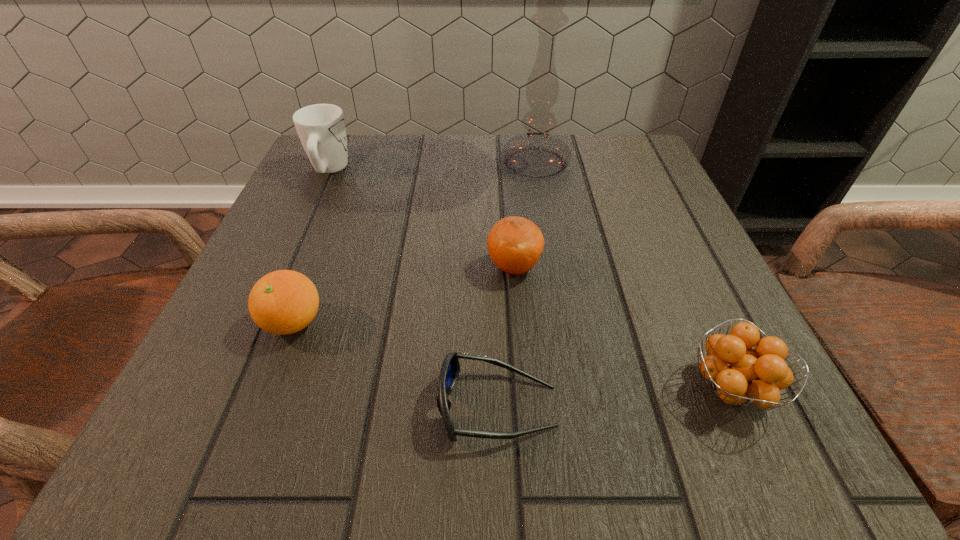
Find the location of a particular element. This screenshot has width=960, height=540. mug that is at the far edge is located at coordinates (321, 128).

You are a GUI agent. You are given a task and a screenshot of the screen. Output one action in this format:
    pyautogui.click(x=<x>, y=<y>)
    Task: Click on the orange fruit that is positioned at the near edge
    
    Given the screenshot: What is the action you would take?
    pyautogui.click(x=738, y=373)

Where is `sunglasses that is positioned at the near edge`? The width and height of the screenshot is (960, 540). sunglasses that is positioned at the near edge is located at coordinates (450, 369).

Identify the location of mug positioned at the left edge. (321, 128).

Identify the location of orange that is at the left edge. (283, 302).

This screenshot has height=540, width=960. What are the coordinates of `table lamp positioned at the right edge` in the screenshot? It's located at (537, 154).

Locate an element on the screen. This screenshot has height=540, width=960. orange fruit present at the right edge is located at coordinates (738, 373).

The width and height of the screenshot is (960, 540). I want to click on object that is at the far left corner, so click(x=321, y=128).

The image size is (960, 540). Identify the location of object at the far right corner. (537, 154).

Locate an element on the screen. This screenshot has width=960, height=540. object that is at the near right corner is located at coordinates (738, 373).